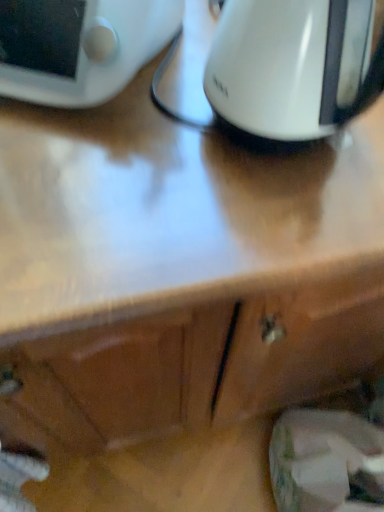
Question: Is the position of white glossy digital clock at upper left more distant than that of white glossy kettle at upper center?

Choices:
 (A) no
 (B) yes

Answer: (B)

Question: Is white glossy digital clock at upper left oriented towards white glossy kettle at upper center?

Choices:
 (A) no
 (B) yes

Answer: (A)

Question: From a real-world perspective, is white glossy digital clock at upper left located beneath white glossy kettle at upper center?

Choices:
 (A) yes
 (B) no

Answer: (A)

Question: Considering the relative positions of white glossy digital clock at upper left and white glossy kettle at upper center in the image provided, is white glossy digital clock at upper left to the left of white glossy kettle at upper center from the viewer's perspective?

Choices:
 (A) yes
 (B) no

Answer: (A)

Question: From a real-world perspective, is white glossy digital clock at upper left over white glossy kettle at upper center?

Choices:
 (A) yes
 (B) no

Answer: (B)

Question: From the image's perspective, is white glossy digital clock at upper left on top of white glossy kettle at upper center?

Choices:
 (A) no
 (B) yes

Answer: (B)

Question: Are white glossy kettle at upper center and white glossy digital clock at upper left far apart?

Choices:
 (A) yes
 (B) no

Answer: (B)

Question: Is white glossy kettle at upper center positioned beyond the bounds of white glossy digital clock at upper left?

Choices:
 (A) yes
 (B) no

Answer: (A)

Question: Considering the relative sizes of white glossy kettle at upper center and white glossy digital clock at upper left in the image provided, is white glossy kettle at upper center taller than white glossy digital clock at upper left?

Choices:
 (A) no
 (B) yes

Answer: (B)

Question: From a real-world perspective, is white glossy kettle at upper center beneath white glossy digital clock at upper left?

Choices:
 (A) no
 (B) yes

Answer: (A)

Question: Considering the relative positions of white glossy kettle at upper center and white glossy digital clock at upper left in the image provided, is white glossy kettle at upper center to the left of white glossy digital clock at upper left from the viewer's perspective?

Choices:
 (A) yes
 (B) no

Answer: (B)

Question: Is white glossy kettle at upper center next to white glossy digital clock at upper left?

Choices:
 (A) no
 (B) yes

Answer: (A)

Question: Is white glossy kettle at upper center taller or shorter than white glossy digital clock at upper left?

Choices:
 (A) short
 (B) tall

Answer: (B)